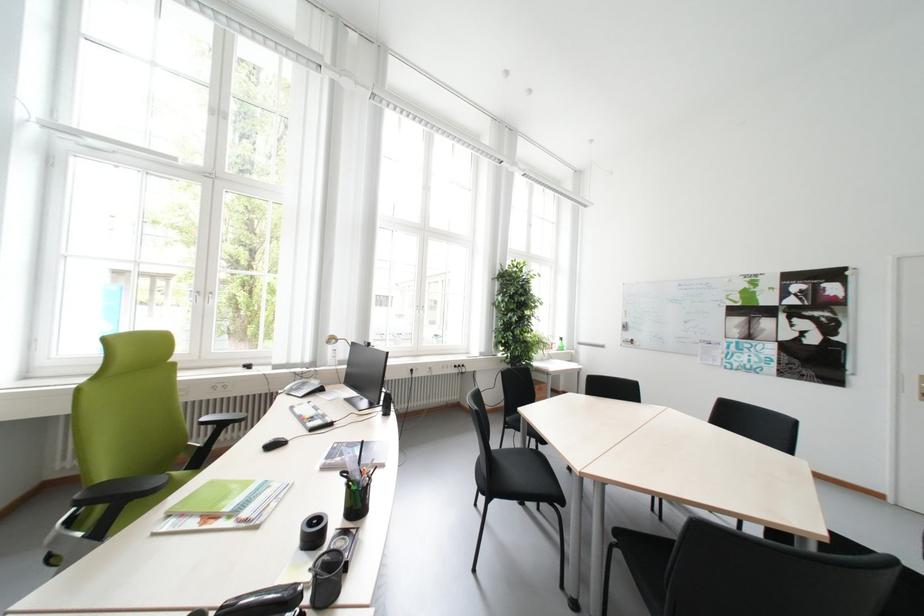
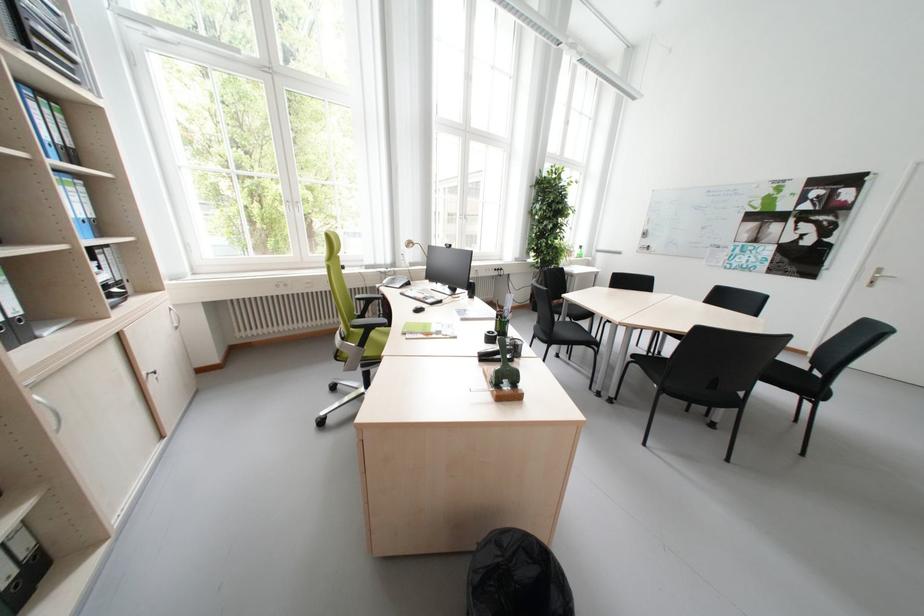
The images are taken continuously from a first-person perspective. In which direction are you moving?

The movement direction of the cameraman is left, backward.